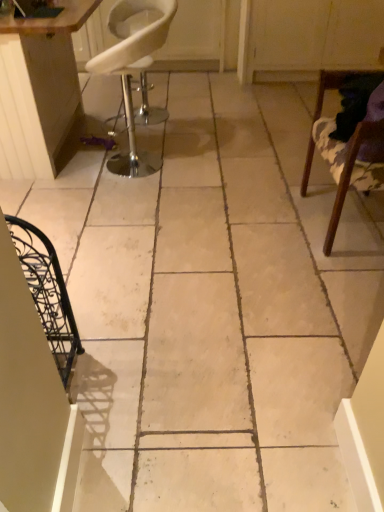
Question: Is point (1, 167) positioned closer to the camera than point (329, 83)?

Choices:
 (A) farther
 (B) closer

Answer: (A)

Question: From their relative heights in the image, would you say wooden table at upper left is taller or shorter than wooden chair at right, which ranks as the second chair in left-to-right order?

Choices:
 (A) tall
 (B) short

Answer: (A)

Question: Estimate the real-world distances between objects in this image. Which object is closer to the wooden table at upper left?

Choices:
 (A) white plastic chair at upper left, marked as the 2th chair in a right-to-left arrangement
 (B) wooden chair at right, acting as the first chair starting from the right

Answer: (B)

Question: Estimate the real-world distances between objects in this image. Which object is closer to the white plastic chair at upper left, which is counted as the first chair, starting from the left?

Choices:
 (A) wooden chair at right, which ranks as the second chair in left-to-right order
 (B) wooden table at upper left

Answer: (B)